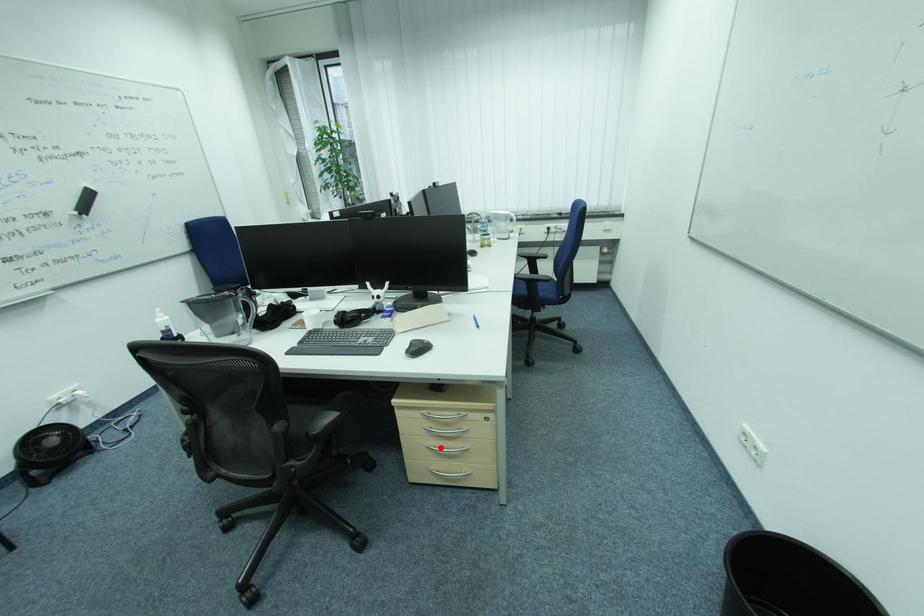
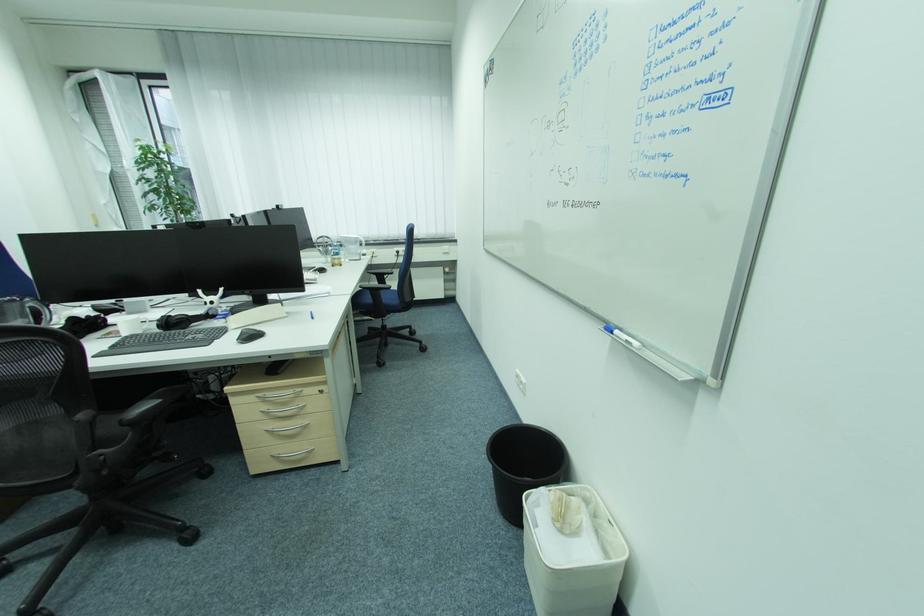
Question: I am providing you with two images of the same scene from different viewpoints. A red point is shown in image1. For the corresponding object point in image2, is it positioned nearer or farther from the camera?

Choices:
 (A) Nearer
 (B) Farther

Answer: (A)